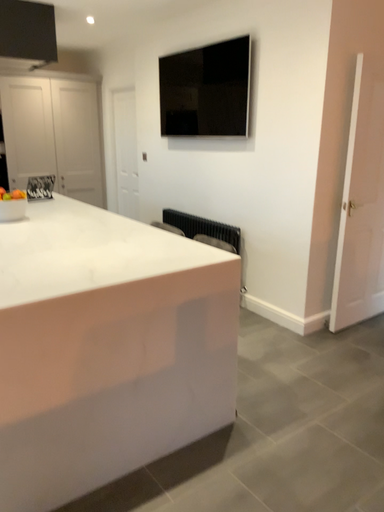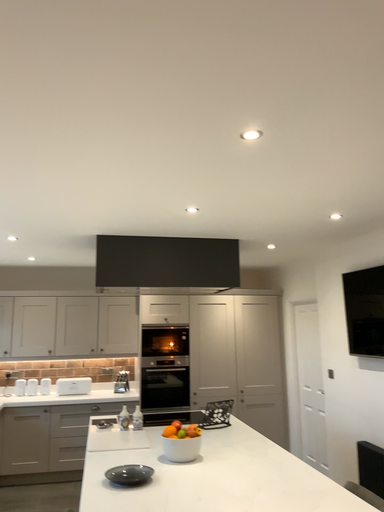
Question: How did the camera likely rotate when shooting the video?

Choices:
 (A) rotated upward
 (B) rotated downward

Answer: (A)